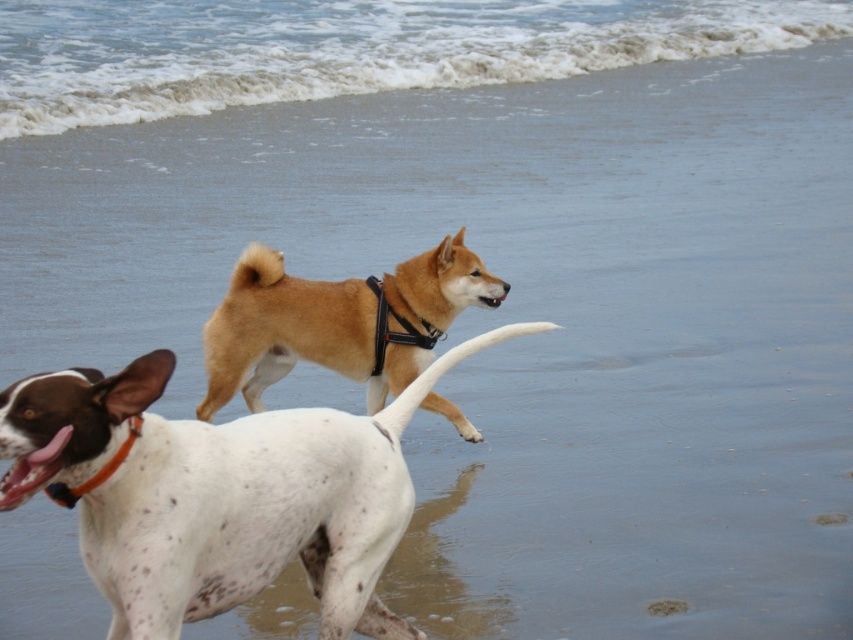
Is white speckled fur at center behind orange nylon collar at lower left?

No, it is in front of orange nylon collar at lower left.

Can you confirm if white speckled fur at center is smaller than orange nylon collar at lower left?

Actually, white speckled fur at center might be larger than orange nylon collar at lower left.

Between point (91, 522) and point (115, 465), which one is positioned in front?

Point (115, 465) is more forward.

Where is `white speckled fur at center`? white speckled fur at center is located at coordinates (219, 493).

Is white speckled fur at center shorter than golden fur dog at center?

No, white speckled fur at center is not shorter than golden fur dog at center.

Describe the element at coordinates (219, 493) in the screenshot. Image resolution: width=853 pixels, height=640 pixels. I see `white speckled fur at center` at that location.

This screenshot has height=640, width=853. In order to click on white speckled fur at center in this screenshot , I will do `click(219, 493)`.

Looking at this image, does golden fur dog at center appear under orange nylon collar at lower left?

Actually, golden fur dog at center is above orange nylon collar at lower left.

Locate an element on the screen. Image resolution: width=853 pixels, height=640 pixels. golden fur dog at center is located at coordinates (337, 323).